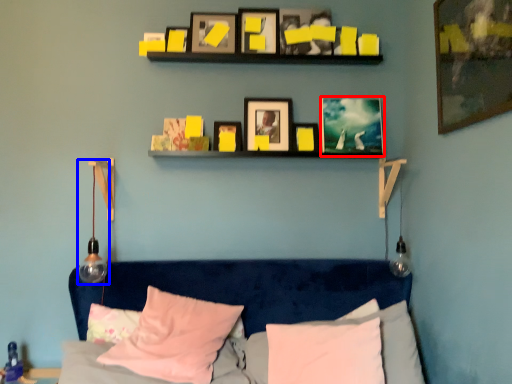
Question: Which point is closer to the camera, picture frame (highlighted by a red box) or lamp (highlighted by a blue box)?

Choices:
 (A) picture frame
 (B) lamp

Answer: (B)